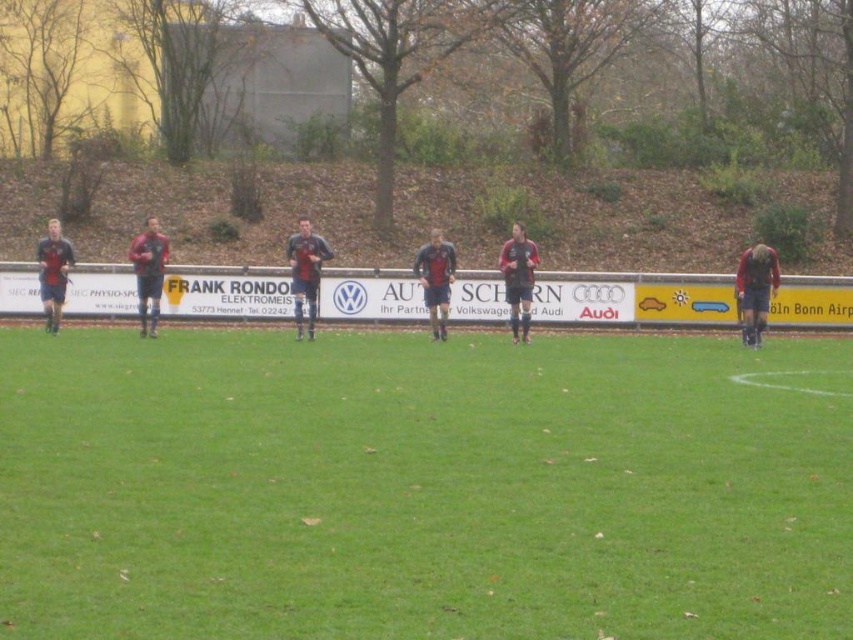
You are a soccer player standing on the field. You need to kick a ball placed on the green grass at center towards the matte red jacket at right. Which object will the ball hit first?

The ball will hit the matte red jacket at right first because it is closer to the green grass at center than the green grass at center is tall.